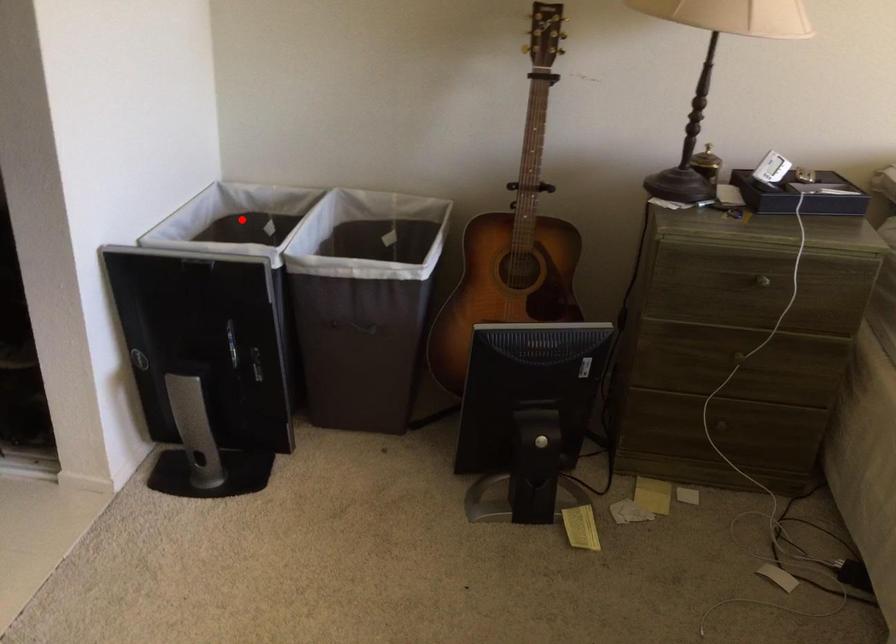
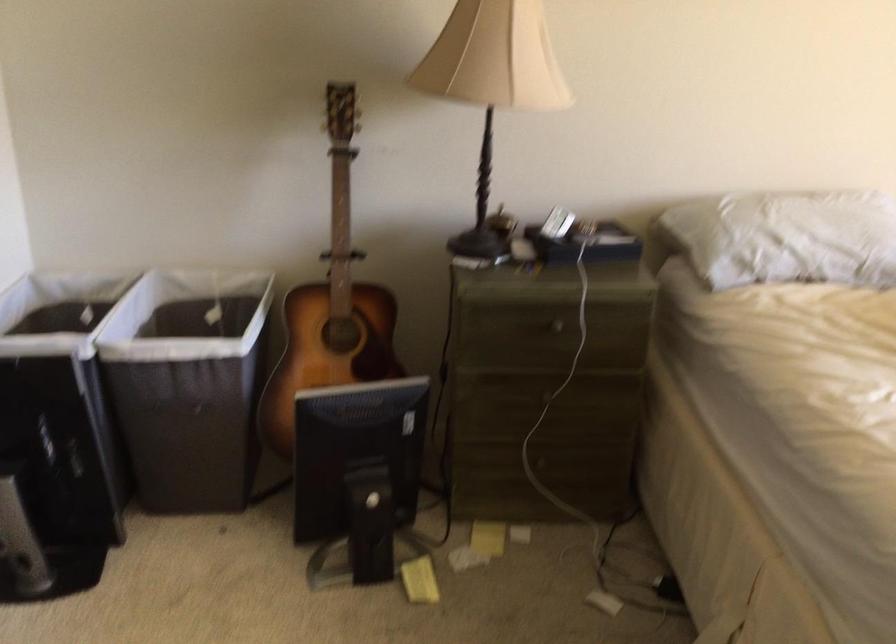
Where in the second image is the point corresponding to the highlighted location from the first image?

(57, 310)